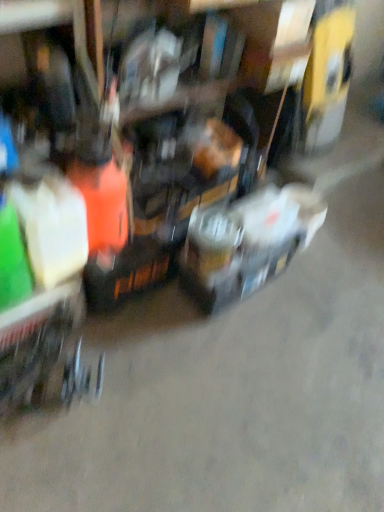
Question: Considering the relative positions of metallic silver toolbox at center and metallic silver trolley at lower left in the image provided, is metallic silver toolbox at center to the left or to the right of metallic silver trolley at lower left?

Choices:
 (A) left
 (B) right

Answer: (B)

Question: Is metallic silver toolbox at center taller or shorter than metallic silver trolley at lower left?

Choices:
 (A) short
 (B) tall

Answer: (B)

Question: Is point (x=215, y=227) closer or farther from the camera than point (x=31, y=379)?

Choices:
 (A) closer
 (B) farther

Answer: (B)

Question: From a real-world perspective, is metallic silver trolley at lower left physically located above or below metallic silver toolbox at center?

Choices:
 (A) below
 (B) above

Answer: (A)

Question: In the image, is metallic silver trolley at lower left on the left side or the right side of metallic silver toolbox at center?

Choices:
 (A) left
 (B) right

Answer: (A)

Question: In terms of height, does metallic silver trolley at lower left look taller or shorter compared to metallic silver toolbox at center?

Choices:
 (A) tall
 (B) short

Answer: (B)

Question: Looking at their shapes, would you say metallic silver trolley at lower left is wider or thinner than metallic silver toolbox at center?

Choices:
 (A) thin
 (B) wide

Answer: (B)